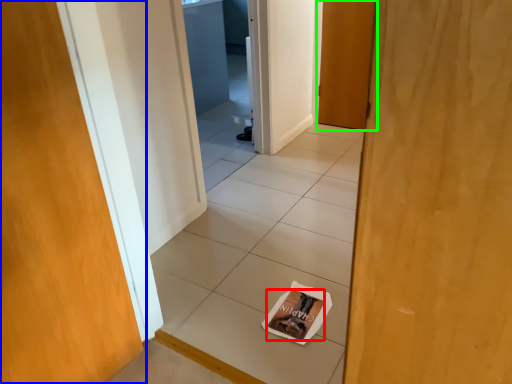
Question: Estimate the real-world distances between objects in this image. Which object is farther from magazine (highlighted by a red box), door (highlighted by a blue box) or door (highlighted by a green box)?

Choices:
 (A) door
 (B) door

Answer: (B)